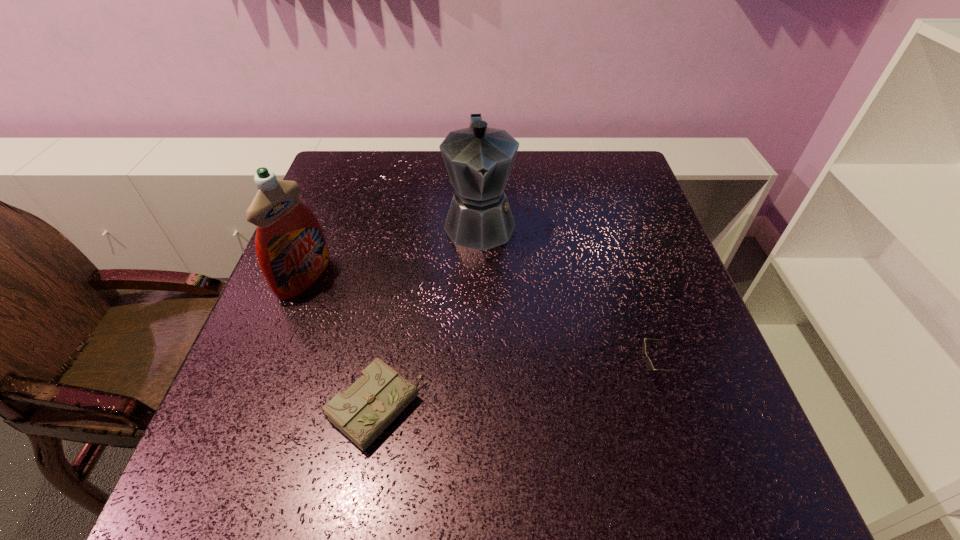
The height and width of the screenshot is (540, 960). In order to click on object located in the right edge section of the desktop in this screenshot , I will do `click(649, 365)`.

The width and height of the screenshot is (960, 540). In order to click on object that is at the near right corner in this screenshot , I will do `click(649, 365)`.

In the image, there is a desktop. At what (x,y) coordinates should I click in order to perform the action: click on free space at the far edge. Please return your answer as a coordinate pair (x, y). The image size is (960, 540). Looking at the image, I should click on (554, 173).

Locate an element on the screen. vacant space at the near edge of the desktop is located at coordinates (601, 397).

Locate an element on the screen. The height and width of the screenshot is (540, 960). free space at the left edge of the desktop is located at coordinates (346, 206).

Where is `vacant area at the right edge of the desktop`? This screenshot has height=540, width=960. vacant area at the right edge of the desktop is located at coordinates (660, 235).

The width and height of the screenshot is (960, 540). I want to click on blank space at the far left corner of the desktop, so click(345, 186).

In the image, there is a desktop. Where is `vacant space at the near left corner`? This screenshot has height=540, width=960. vacant space at the near left corner is located at coordinates (306, 406).

Image resolution: width=960 pixels, height=540 pixels. Identify the location of vacant area at the far right corner. (600, 157).

Locate an element on the screen. The image size is (960, 540). blank space at the near right corner of the desktop is located at coordinates (654, 422).